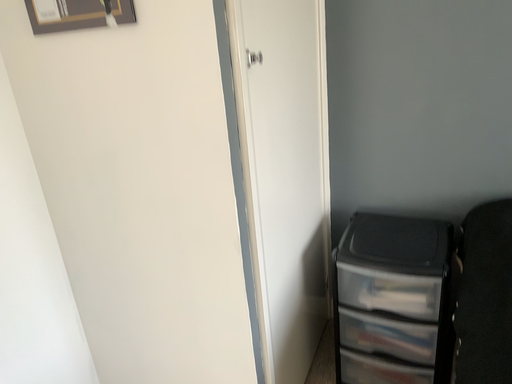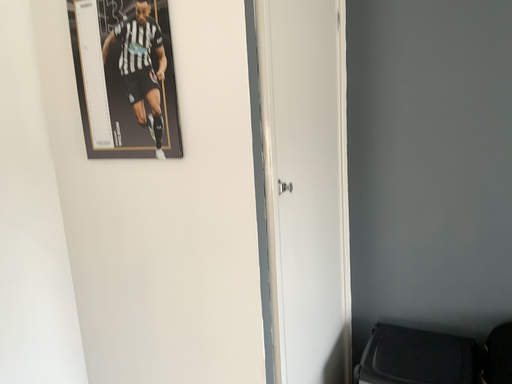
Question: Which way did the camera rotate in the video?

Choices:
 (A) rotated upward
 (B) rotated downward

Answer: (A)